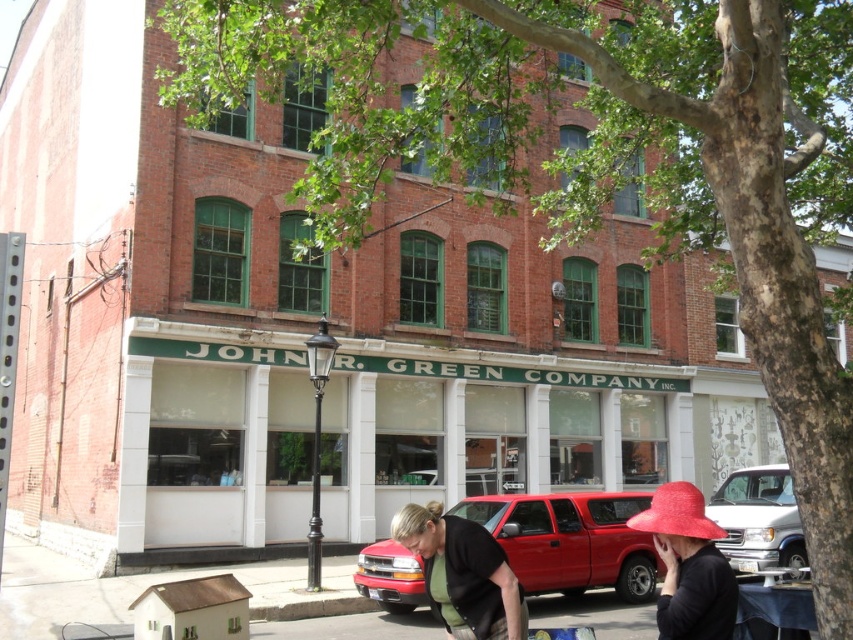
You are a delivery driver who needs to park your 5.5 meter long truck between the black matte street vendor at lower center and the silver metallic van at center. Can you fit your truck in that space?

The distance between the black matte street vendor at lower center and the silver metallic van at center is 9.17 meters. Since your truck is 5.5 meters long, there is enough space to park it between them.

You are a delivery person trying to unload packages from the silver metallic van at center. There is a black matte street vendor at lower center in the way. Can you move the street vendor to access the van?

The black matte street vendor at lower center is positioned over the silver metallic van at center, so you cannot access the van without moving the street vendor first.

You are a delivery driver who needs to park your vehicle in the parking lot behind the building. The parking spot you want to use is only large enough for vehicles smaller than the metallic red truck at center. Can you park your silver metallic van at center there?

The metallic red truck at center is bigger than the silver metallic van at center, so the silver metallic van at center is smaller and can fit into the parking spot designed for vehicles smaller than the metallic red truck at center.